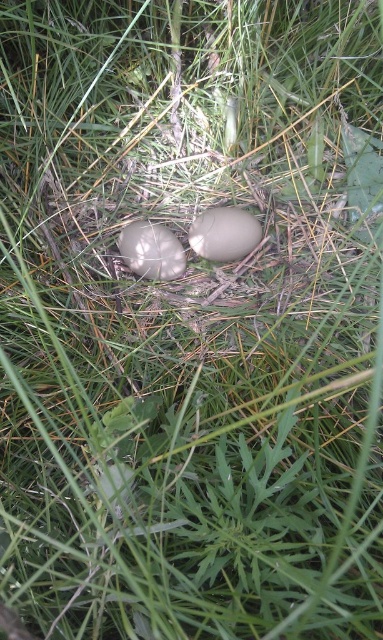
Does smooth brown egg at center appear under smooth beige egg at center?

No, smooth brown egg at center is not below smooth beige egg at center.

How much distance is there between smooth brown egg at center and smooth beige egg at center?

smooth brown egg at center and smooth beige egg at center are 10.65 centimeters apart from each other.

Does point (237, 227) come closer to viewer compared to point (176, 240)?

Yes, point (237, 227) is closer to viewer.

This screenshot has height=640, width=383. I want to click on smooth brown egg at center, so click(x=224, y=234).